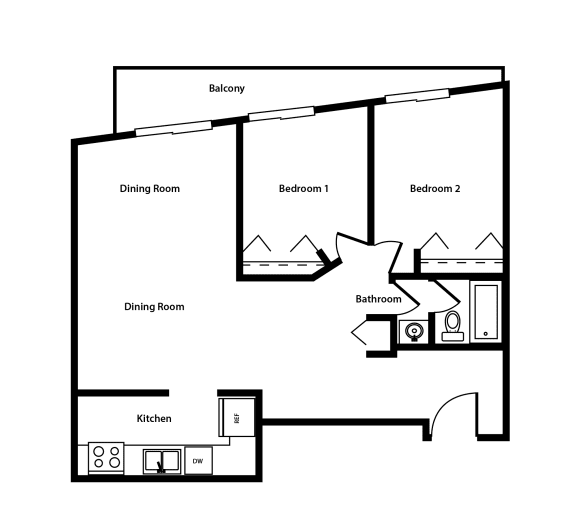
You are a GUI agent. You are given a task and a screenshot of the screen. Output one action in this format:
    pyautogui.click(x=<x>, y=<y>)
    Task: Click on the door
    
    Given the screenshot: What is the action you would take?
    pyautogui.click(x=263, y=241)